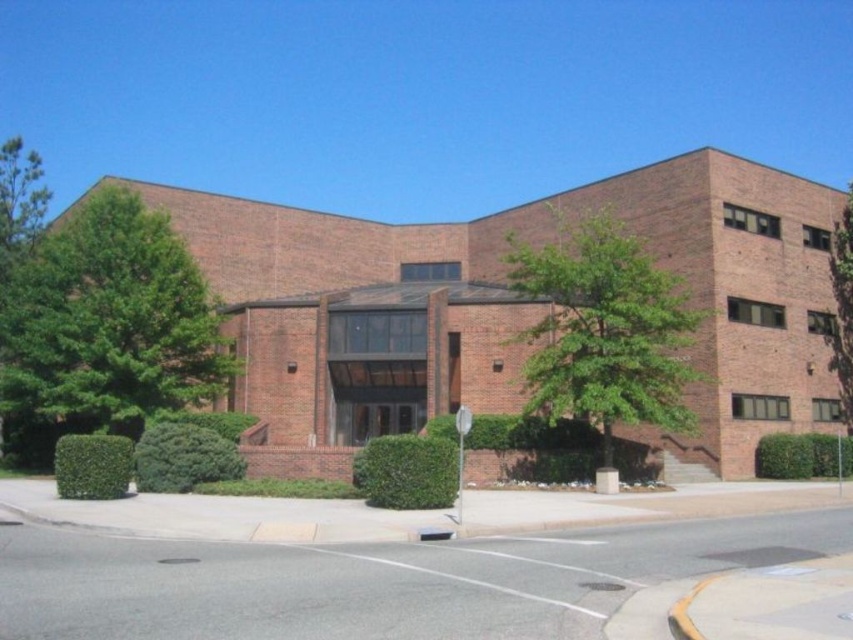
You are standing in front of the building and want to walk towards the green leafy tree at left and the green leafy tree at center. Which tree will you reach first?

The green leafy tree at left is closer to you, so you will reach it first because it is positioned further to the viewer than the green leafy tree at center.

You are standing in front of the building and notice two green leafy trees. One is labeled as the green leafy tree at left and the other as the green leafy tree at right. Which tree is positioned to the left of the other?

The green leafy tree at left is positioned on the left side of the green leafy tree at right.